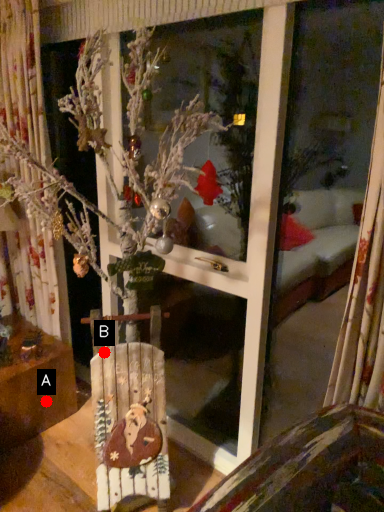
Question: Two points are circled on the image, labeled by A and B beside each circle. Which point is farther to the camera?

Choices:
 (A) A is further
 (B) B is further

Answer: (A)